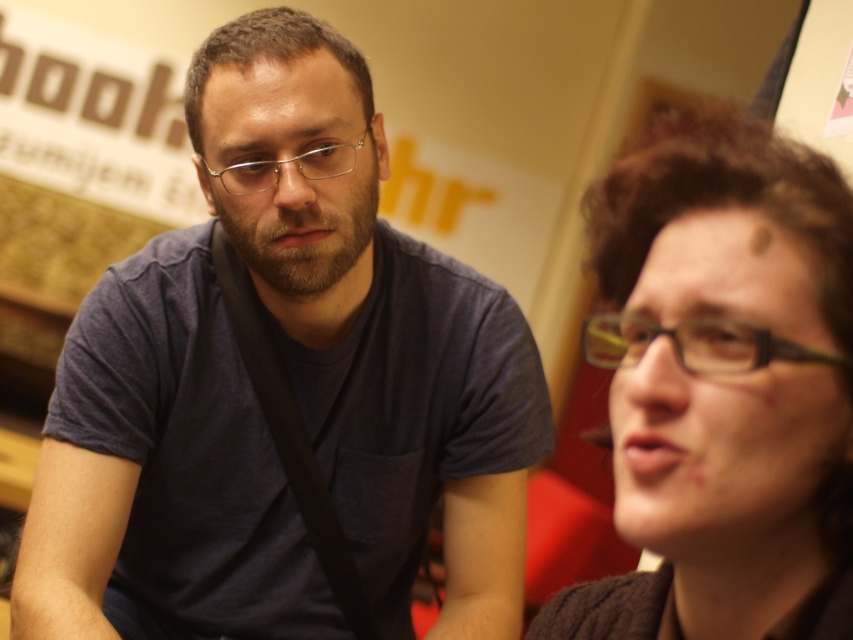
Question: Does matte black hair at right appear on the left side of clear plastic glasses at right?

Choices:
 (A) no
 (B) yes

Answer: (B)

Question: Which point is farther from the camera taking this photo?

Choices:
 (A) (265, 180)
 (B) (273, 196)
 (C) (814, 561)
 (D) (808, 358)

Answer: (A)

Question: Which point appears farthest from the camera in this image?

Choices:
 (A) (814, 474)
 (B) (357, 154)
 (C) (428, 392)
 (D) (846, 358)

Answer: (C)

Question: Among these points, which one is nearest to the camera?

Choices:
 (A) click(x=693, y=353)
 (B) click(x=125, y=502)
 (C) click(x=242, y=188)

Answer: (A)

Question: Considering the relative positions of dark blue t-shirt at left and matte black hair at right in the image provided, where is dark blue t-shirt at left located with respect to matte black hair at right?

Choices:
 (A) below
 (B) above

Answer: (B)

Question: Does dark blue t-shirt at left appear over matte black hair at right?

Choices:
 (A) no
 (B) yes

Answer: (B)